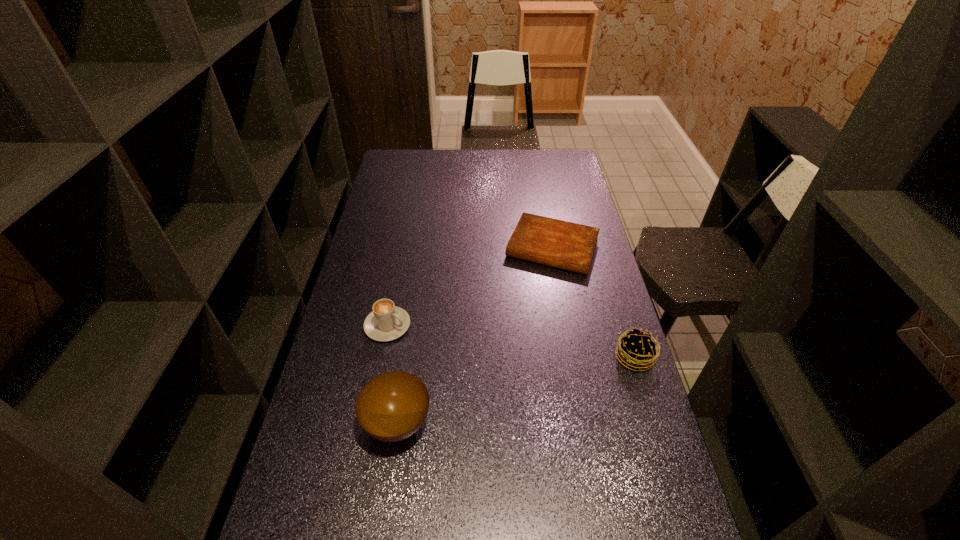
Locate an element on the screen. The height and width of the screenshot is (540, 960). vacant space at the far left corner of the desktop is located at coordinates (384, 171).

Identify the location of vacant space at the near left corner of the desktop. Image resolution: width=960 pixels, height=540 pixels. pyautogui.click(x=287, y=512).

Where is `vacant space at the near right corner`? vacant space at the near right corner is located at coordinates (616, 522).

Find the location of a particular element. free space between the farthest object and the patty is located at coordinates (593, 302).

Locate an element on the screen. Image resolution: width=960 pixels, height=540 pixels. vacant space in between the patty and the shortest object is located at coordinates (593, 302).

Where is `vacant space that's between the cappuccino and the shortest object`? vacant space that's between the cappuccino and the shortest object is located at coordinates (469, 287).

The width and height of the screenshot is (960, 540). In order to click on unoccupied position between the shortest object and the nearest object in this screenshot , I will do `click(475, 335)`.

In order to click on empty space between the patty and the shortest object in this screenshot , I will do `click(593, 302)`.

Locate an element on the screen. vacant space that's between the cappuccino and the Bible is located at coordinates (469, 287).

Where is `blank region between the nearest object and the patty`? The height and width of the screenshot is (540, 960). blank region between the nearest object and the patty is located at coordinates (516, 390).